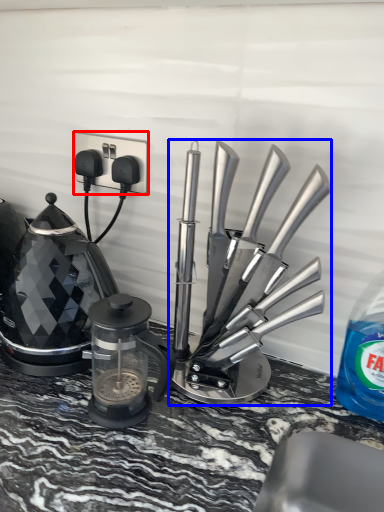
Question: Which point is closer to the camera, electric outlet (highlighted by a red box) or kitchen appliance (highlighted by a blue box)?

Choices:
 (A) electric outlet
 (B) kitchen appliance

Answer: (B)